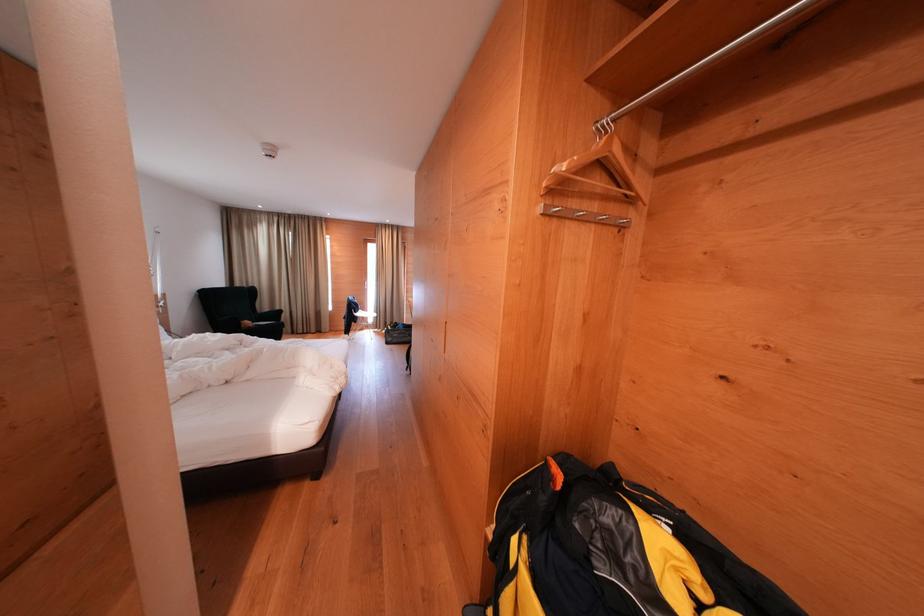
Where is `wooden clothes hanger`? wooden clothes hanger is located at coordinates (597, 169).